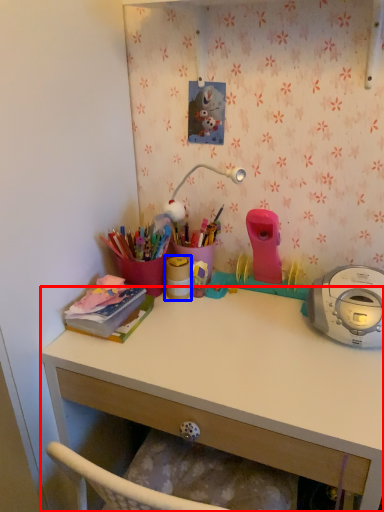
Question: Which object is further to the camera taking this photo, desk (highlighted by a red box) or office supplies (highlighted by a blue box)?

Choices:
 (A) desk
 (B) office supplies

Answer: (B)